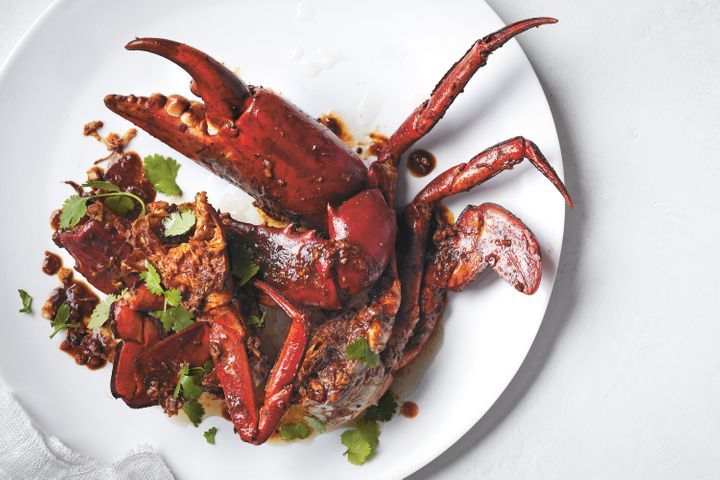
Find the location of a particular element. Image resolution: width=720 pixels, height=480 pixels. table is located at coordinates (587, 323).